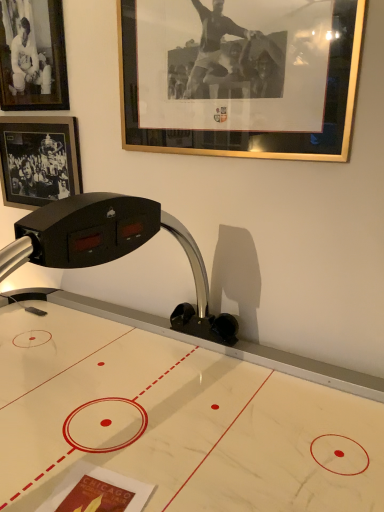
Question: Can you confirm if matte black photo frame at upper left, positioned as the 2th picture frame in right-to-left order, is smaller than white glossy air hockey table at center?

Choices:
 (A) yes
 (B) no

Answer: (A)

Question: Could you tell me if matte black photo frame at upper left, which appears as the 2th picture frame when viewed from the left, is turned towards white glossy air hockey table at center?

Choices:
 (A) no
 (B) yes

Answer: (A)

Question: Can you confirm if matte black photo frame at upper left, which appears as the 2th picture frame when viewed from the left, is shorter than white glossy air hockey table at center?

Choices:
 (A) no
 (B) yes

Answer: (B)

Question: Is matte black photo frame at upper left, which appears as the 2th picture frame when viewed from the left, taller than white glossy air hockey table at center?

Choices:
 (A) yes
 (B) no

Answer: (B)

Question: Is matte black photo frame at upper left, positioned as the 2th picture frame in right-to-left order, completely or partially outside of white glossy air hockey table at center?

Choices:
 (A) no
 (B) yes

Answer: (B)

Question: Is matte black photo frame at upper left, which appears as the 2th picture frame when viewed from the left, to the left of white glossy air hockey table at center from the viewer's perspective?

Choices:
 (A) no
 (B) yes

Answer: (B)

Question: Is gold-framed picture at upper center, which ranks as the 1th picture frame in right-to-left order, at the back of black matte picture frame at upper left, the first picture frame when ordered from left to right?

Choices:
 (A) yes
 (B) no

Answer: (B)

Question: Are black matte picture frame at upper left, arranged as the third picture frame when viewed from the right, and gold-framed picture at upper center, which ranks as the 1th picture frame in right-to-left order, beside each other?

Choices:
 (A) no
 (B) yes

Answer: (A)

Question: Is black matte picture frame at upper left, the first picture frame when ordered from left to right, facing towards gold-framed picture at upper center, placed as the third picture frame when sorted from left to right?

Choices:
 (A) yes
 (B) no

Answer: (B)

Question: Can you confirm if black matte picture frame at upper left, arranged as the third picture frame when viewed from the right, is positioned to the right of gold-framed picture at upper center, placed as the third picture frame when sorted from left to right?

Choices:
 (A) yes
 (B) no

Answer: (B)

Question: From a real-world perspective, is black matte picture frame at upper left, arranged as the third picture frame when viewed from the right, positioned under gold-framed picture at upper center, which ranks as the 1th picture frame in right-to-left order, based on gravity?

Choices:
 (A) yes
 (B) no

Answer: (A)

Question: Can you confirm if black matte picture frame at upper left, arranged as the third picture frame when viewed from the right, is thinner than gold-framed picture at upper center, which ranks as the 1th picture frame in right-to-left order?

Choices:
 (A) yes
 (B) no

Answer: (B)

Question: Is white glossy air hockey table at center aimed at gold-framed picture at upper center, which ranks as the 1th picture frame in right-to-left order?

Choices:
 (A) yes
 (B) no

Answer: (B)